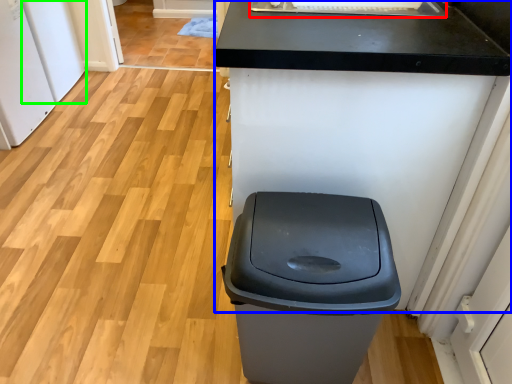
Question: Considering the real-world distances, which object is closest to sink (highlighted by a red box)? counter (highlighted by a blue box) or appliance (highlighted by a green box).

Choices:
 (A) counter
 (B) appliance

Answer: (A)